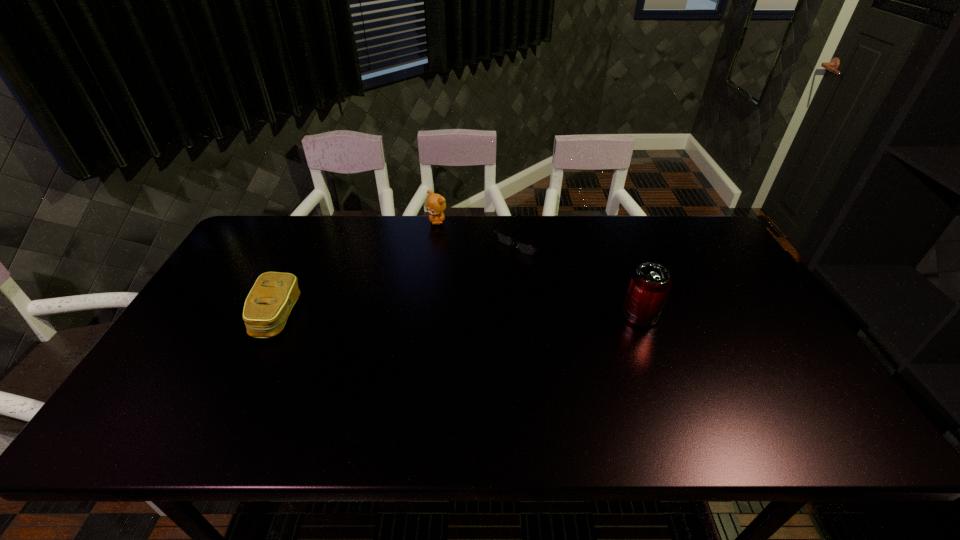
Locate an element on the screen. clutch bag is located at coordinates (267, 307).

Locate an element on the screen. The width and height of the screenshot is (960, 540). the leftmost object is located at coordinates (267, 307).

The image size is (960, 540). Find the location of `the rightmost object`. the rightmost object is located at coordinates (650, 284).

The width and height of the screenshot is (960, 540). I want to click on soda can, so click(650, 284).

Locate an element on the screen. the shortest object is located at coordinates (525, 248).

You are a GUI agent. You are given a task and a screenshot of the screen. Output one action in this format:
    pyautogui.click(x=<x>, y=<y>)
    Task: Click on the spectacles
    The image size is (960, 540).
    Given the screenshot: What is the action you would take?
    pyautogui.click(x=525, y=248)

Where is `the third shortest object`? The width and height of the screenshot is (960, 540). the third shortest object is located at coordinates click(x=435, y=205).

Locate an element on the screen. This screenshot has width=960, height=540. the second object from left to right is located at coordinates (435, 205).

At what (x,y) coordinates should I click in order to perform the action: click on free space located on the zipper side of the third tallest object. Please return your answer as a coordinate pair (x, y). Image resolution: width=960 pixels, height=540 pixels. Looking at the image, I should click on (195, 316).

The height and width of the screenshot is (540, 960). What are the coordinates of `free region located 0.090m on the zipper side of the third tallest object` in the screenshot? It's located at (225, 316).